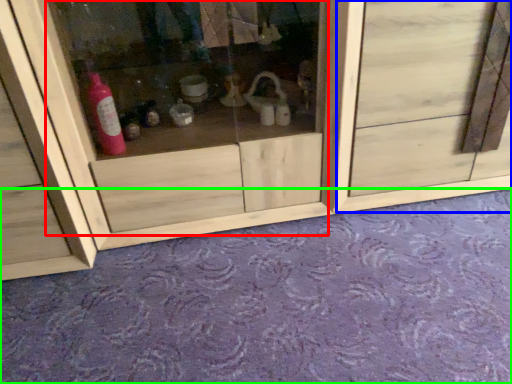
Question: Estimate the real-world distances between objects in this image. Which object is farther from glass door (highlighted by a red box), door (highlighted by a blue box) or plain (highlighted by a green box)?

Choices:
 (A) door
 (B) plain

Answer: (B)